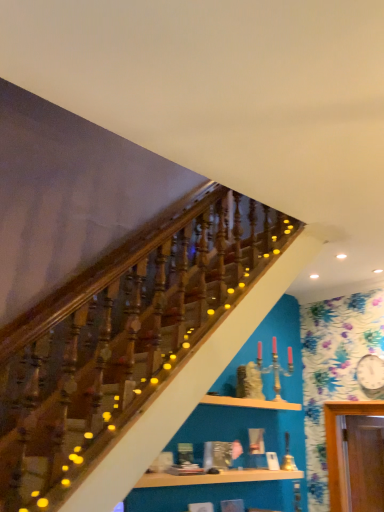
Question: Which direction should I rotate to look at wooden shelf at lower center, acting as the 1th shelf starting from the bottom, — up or down?

Choices:
 (A) down
 (B) up

Answer: (A)

Question: Does wooden shelf at center, acting as the 2th shelf starting from the bottom, have a lesser width compared to wooden shelf at lower center, which is the second shelf in top-to-bottom order?

Choices:
 (A) yes
 (B) no

Answer: (B)

Question: Is wooden shelf at center, acting as the 2th shelf starting from the bottom, oriented towards wooden shelf at lower center, acting as the 1th shelf starting from the bottom?

Choices:
 (A) no
 (B) yes

Answer: (A)

Question: From a real-world perspective, is wooden shelf at center, acting as the 2th shelf starting from the bottom, located beneath wooden shelf at lower center, acting as the 1th shelf starting from the bottom?

Choices:
 (A) no
 (B) yes

Answer: (A)

Question: From the image's perspective, is wooden shelf at center, which ranks as the 1th shelf in top-to-bottom order, below wooden shelf at lower center, acting as the 1th shelf starting from the bottom?

Choices:
 (A) yes
 (B) no

Answer: (B)

Question: Is wooden shelf at center, which ranks as the 1th shelf in top-to-bottom order, shorter than wooden shelf at lower center, acting as the 1th shelf starting from the bottom?

Choices:
 (A) yes
 (B) no

Answer: (B)

Question: Is wooden shelf at center, acting as the 2th shelf starting from the bottom, to the left of wooden shelf at lower center, acting as the 1th shelf starting from the bottom, from the viewer's perspective?

Choices:
 (A) yes
 (B) no

Answer: (B)

Question: Could you tell me if wooden shelf at lower center, acting as the 1th shelf starting from the bottom, is facing wooden shelf at center, which ranks as the 1th shelf in top-to-bottom order?

Choices:
 (A) no
 (B) yes

Answer: (A)

Question: Is wooden shelf at lower center, which is the second shelf in top-to-bottom order, wider than wooden shelf at center, acting as the 2th shelf starting from the bottom?

Choices:
 (A) no
 (B) yes

Answer: (A)

Question: Does wooden shelf at lower center, which is the second shelf in top-to-bottom order, come in front of wooden shelf at center, which ranks as the 1th shelf in top-to-bottom order?

Choices:
 (A) yes
 (B) no

Answer: (A)

Question: Considering the relative sizes of wooden shelf at lower center, acting as the 1th shelf starting from the bottom, and wooden shelf at center, acting as the 2th shelf starting from the bottom, in the image provided, is wooden shelf at lower center, acting as the 1th shelf starting from the bottom, bigger than wooden shelf at center, acting as the 2th shelf starting from the bottom,?

Choices:
 (A) yes
 (B) no

Answer: (A)

Question: Can you confirm if wooden shelf at lower center, acting as the 1th shelf starting from the bottom, is positioned to the right of wooden shelf at center, acting as the 2th shelf starting from the bottom?

Choices:
 (A) yes
 (B) no

Answer: (B)

Question: Considering the relative sizes of wooden shelf at lower center, acting as the 1th shelf starting from the bottom, and wooden shelf at center, which ranks as the 1th shelf in top-to-bottom order, in the image provided, is wooden shelf at lower center, acting as the 1th shelf starting from the bottom, taller than wooden shelf at center, which ranks as the 1th shelf in top-to-bottom order,?

Choices:
 (A) yes
 (B) no

Answer: (B)

Question: Considering the positions of wooden shelf at center, acting as the 2th shelf starting from the bottom, and wooden shelf at lower center, acting as the 1th shelf starting from the bottom, in the image, is wooden shelf at center, acting as the 2th shelf starting from the bottom, wider or thinner than wooden shelf at lower center, acting as the 1th shelf starting from the bottom,?

Choices:
 (A) wide
 (B) thin

Answer: (A)